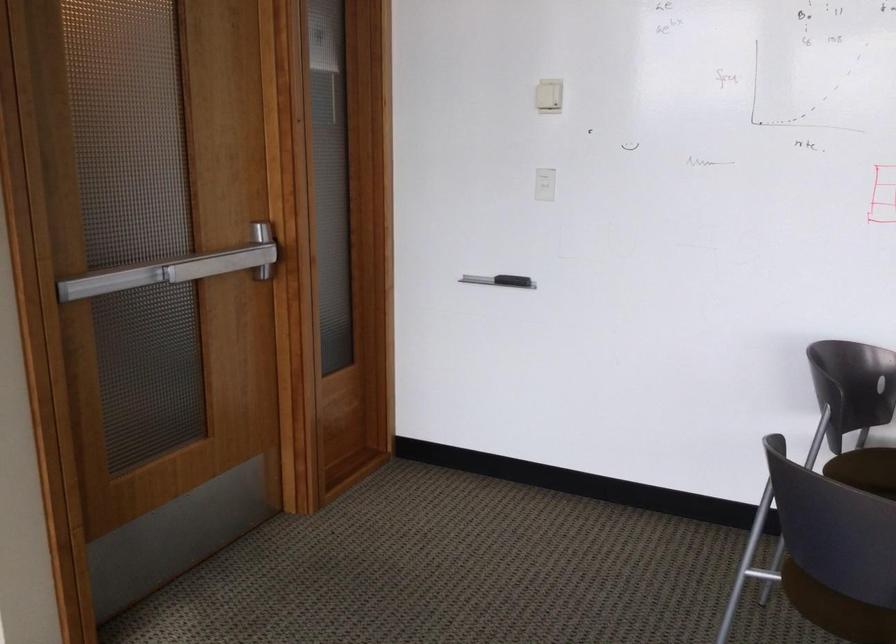
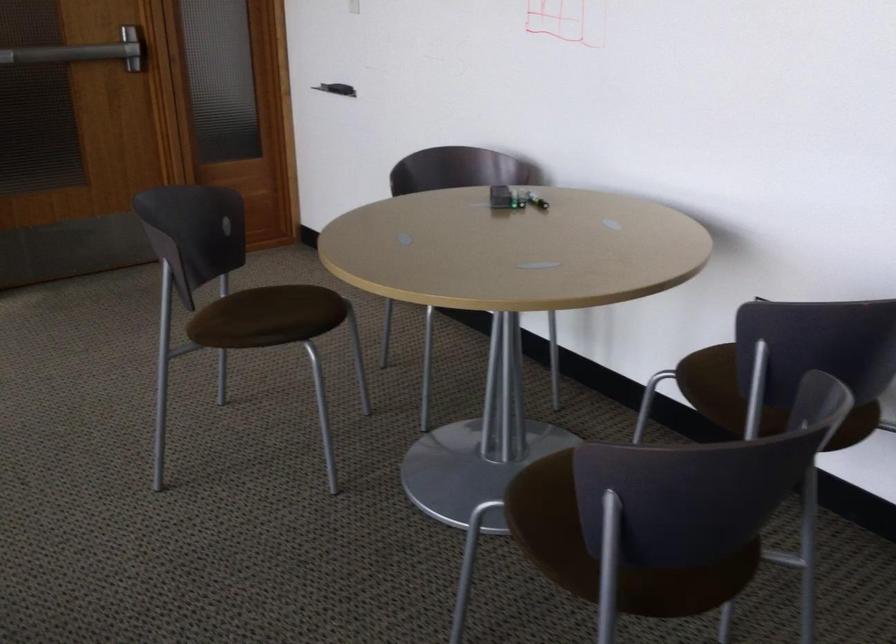
Question: Which direction would the cameraman need to move to produce the second image? Reply with the corresponding letter.

Choices:
 (A) Left
 (B) Right
 (C) Forward
 (D) Backward

Answer: (B)